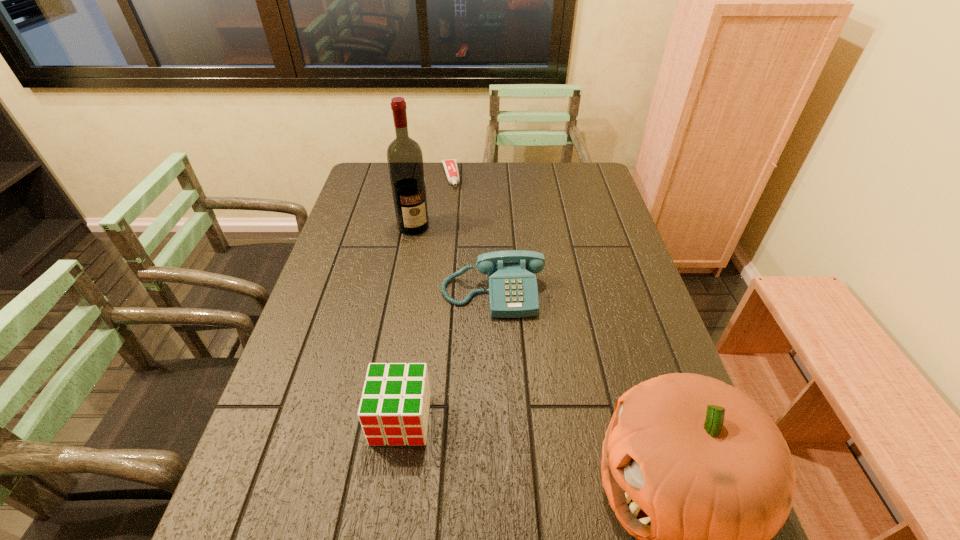
At what (x,y) coordinates should I click in order to perform the action: click on cube. Please return your answer as a coordinate pair (x, y). Looking at the image, I should click on coord(394,409).

Image resolution: width=960 pixels, height=540 pixels. What are the coordinates of `toothpaste` in the screenshot? It's located at (451, 168).

In order to click on the farthest object in this screenshot , I will do `click(451, 168)`.

Identify the location of the fourth nearest object. (404, 155).

This screenshot has width=960, height=540. Identify the location of the tallest object. (404, 155).

Find the location of a particular element. The image size is (960, 540). telephone is located at coordinates (513, 292).

The width and height of the screenshot is (960, 540). What are the coordinates of `vacant space located at the nozzle of the toothpaste` in the screenshot? It's located at (456, 214).

This screenshot has height=540, width=960. What are the coordinates of `blank space located 0.380m at the nozzle of the toothpaste` in the screenshot? It's located at (466, 255).

Locate an element on the screen. The width and height of the screenshot is (960, 540). free region located 0.070m at the nozzle of the toothpaste is located at coordinates (453, 200).

Where is `vacant space located on the front and back of the second farthest object`? The height and width of the screenshot is (540, 960). vacant space located on the front and back of the second farthest object is located at coordinates (451, 302).